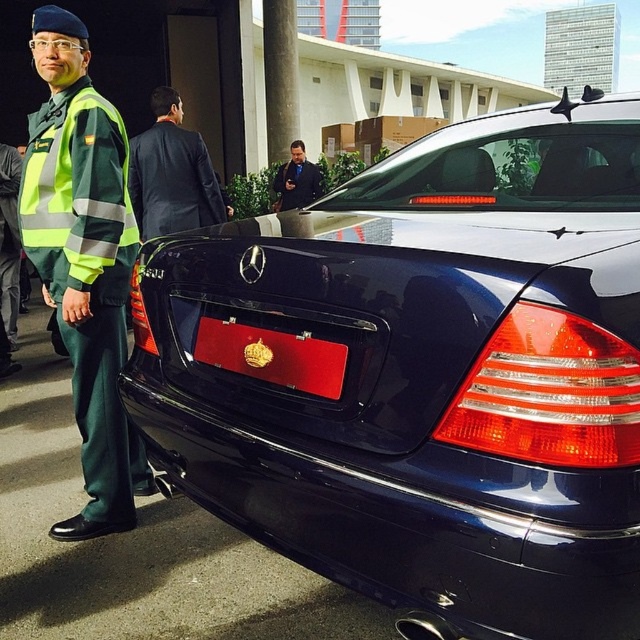
You are a photographer trying to capture a clear photo of the glossy black car at center and the green reflective uniform at left. Since the car is larger, which object should you zoom in on first to ensure both are in focus?

The glossy black car at center is larger than the green reflective uniform at left, so you should zoom in on the glossy black car at center first to ensure it fits within the frame before adjusting for the smaller object.

You are a photographer positioned at the back of the scene. You want to take a photo of the glossy black car at center and the dark blue suit at center. Based on their positions, which object should you adjust your camera to focus on first if you want to capture both in the same frame?

The glossy black car at center is to the right of the dark blue suit at center. To capture both in the same frame, you should focus on the dark blue suit at center first as it is on the left side, ensuring both are within the camera frame when adjusted properly.

You are a photographer trying to capture the glossy black car at center and the dark blue suit at center in a single shot. Based on their positions, which object is closer to the camera?

The glossy black car at center is positioned under the dark blue suit at center, so the dark blue suit at center is closer to the camera.